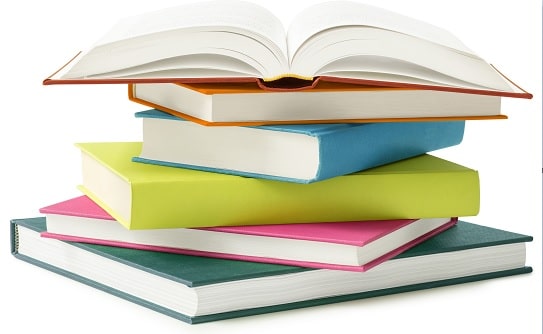
The image size is (543, 334). Identify the location of book. (209, 297), (290, 238), (389, 181), (310, 148), (251, 103), (271, 57).